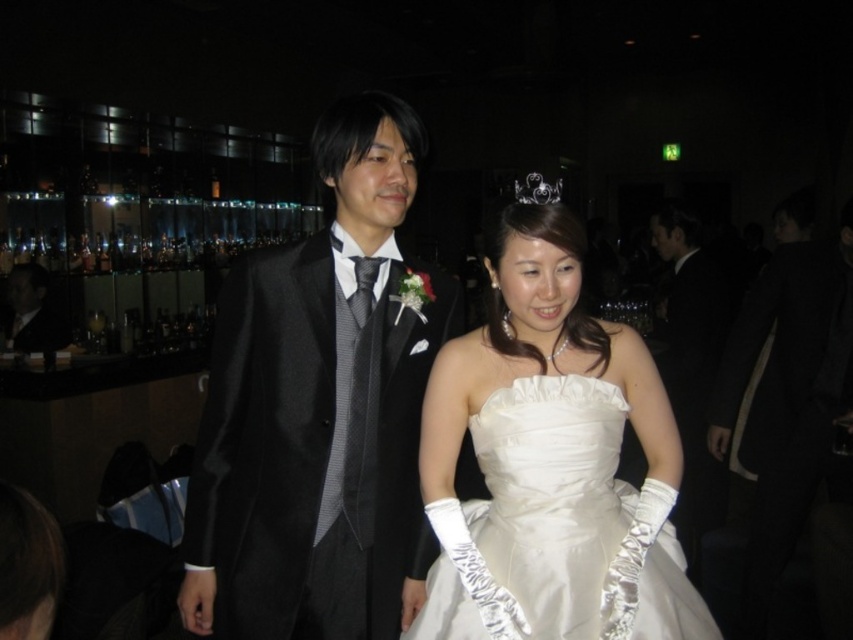
Question: Can you confirm if matte black suit at center is positioned to the left of silver metallic tiara at upper center?

Choices:
 (A) yes
 (B) no

Answer: (A)

Question: Is white satin dress at center bigger than black satin suit at left?

Choices:
 (A) yes
 (B) no

Answer: (A)

Question: Which of the following is the closest to the observer?

Choices:
 (A) silver metallic tiara at upper center
 (B) white satin dress at center

Answer: (B)

Question: Considering the real-world distances, which object is farthest from the black satin suit at left?

Choices:
 (A) matte black suit at center
 (B) silver metallic tiara at upper center
 (C) white satin dress at center

Answer: (B)

Question: Is matte black suit at center smaller than black satin suit at left?

Choices:
 (A) no
 (B) yes

Answer: (A)

Question: Estimate the real-world distances between objects in this image. Which object is farther from the white satin dress at center?

Choices:
 (A) silver metallic tiara at upper center
 (B) black satin suit at left

Answer: (B)